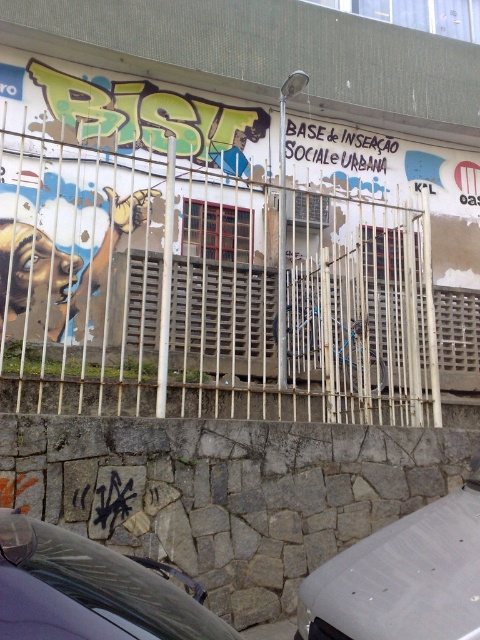
Question: Does white matte car at lower right have a larger size compared to shiny black car at lower left?

Choices:
 (A) no
 (B) yes

Answer: (B)

Question: From the image, what is the correct spatial relationship of white matte car at lower right in relation to shiny black car at lower left?

Choices:
 (A) left
 (B) right

Answer: (B)

Question: Which object appears farthest from the camera in this image?

Choices:
 (A) rusty metal fence at center
 (B) white matte car at lower right

Answer: (A)

Question: Estimate the real-world distances between objects in this image. Which object is farther from the shiny black car at lower left?

Choices:
 (A) white matte car at lower right
 (B) rusty metal fence at center

Answer: (B)

Question: Which is nearer to the white matte car at lower right?

Choices:
 (A) shiny black car at lower left
 (B) rusty metal fence at center

Answer: (A)

Question: Does white matte car at lower right have a lesser width compared to shiny black car at lower left?

Choices:
 (A) no
 (B) yes

Answer: (A)